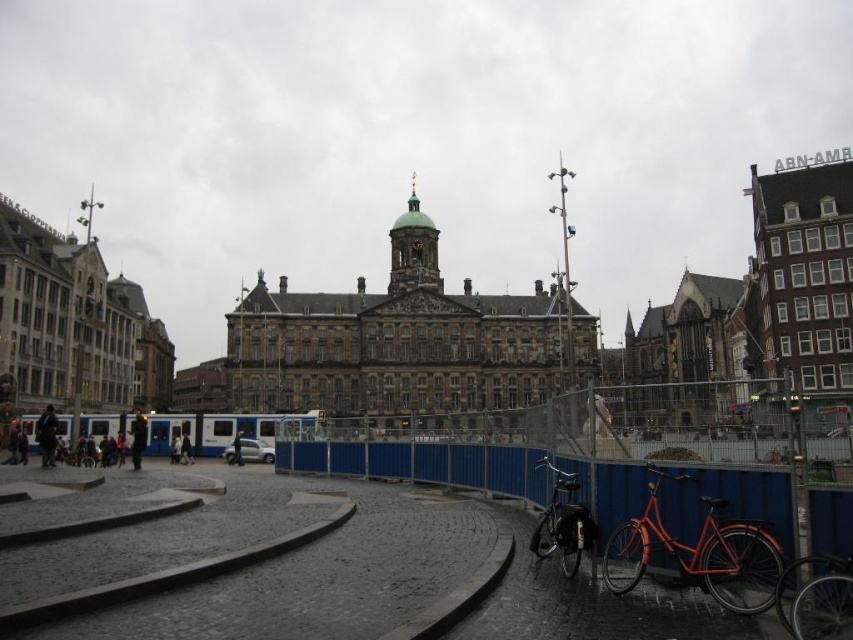
You are a tourist standing in the plaza and want to take a photo of the gold domed tower at center. However, there is a shiny black bicycle at lower right in the way. Can you move the bicycle to get an unobstructed view?

The shiny black bicycle at lower right is closer to the viewer than the gold domed tower at center, so moving the bicycle would allow you to see the gold domed tower at center without obstruction.

You are a tourist standing in the plaza in front of the historic building. You want to take a photo that includes both the shiny red bicycle at lower right and the gold domed tower at center. Which object will appear larger in the photo?

The gold domed tower at center will appear larger in the photo because it is taller than the shiny red bicycle at lower right.